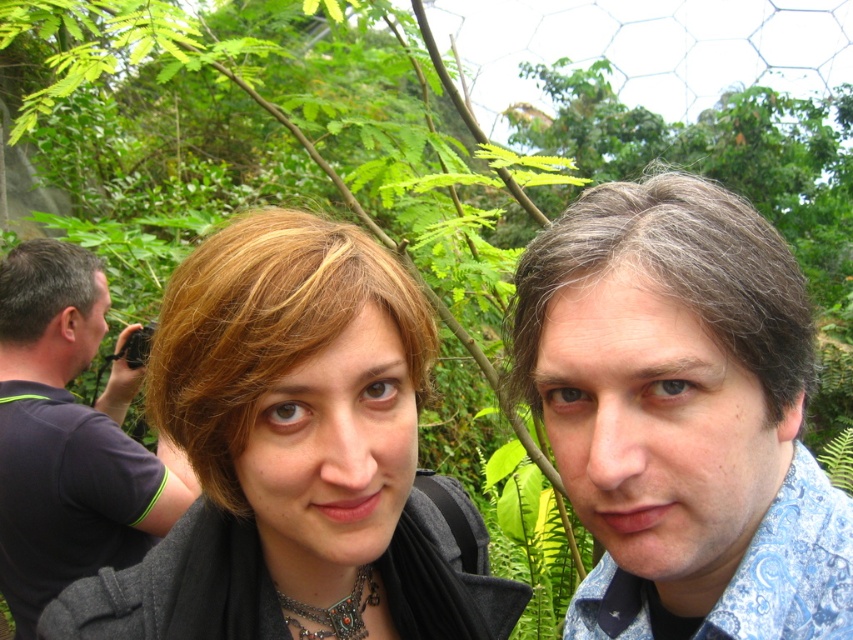
Can you confirm if matte black jacket at center is bigger than dark blue t-shirt at left?

Actually, matte black jacket at center might be smaller than dark blue t-shirt at left.

Is matte black jacket at center thinner than dark blue t-shirt at left?

No.

The width and height of the screenshot is (853, 640). Identify the location of matte black jacket at center. (294, 452).

Can you confirm if blue paisley shirt at right is wider than dark blue t-shirt at left?

Incorrect, blue paisley shirt at right's width does not surpass dark blue t-shirt at left's.

Between blue paisley shirt at right and dark blue t-shirt at left, which one has more height?

Standing taller between the two is dark blue t-shirt at left.

Find the location of `blue paisley shirt at right`. blue paisley shirt at right is located at coordinates (682, 413).

You are a GUI agent. You are given a task and a screenshot of the screen. Output one action in this format:
    pyautogui.click(x=<x>, y=<y>)
    Task: Click on the blue paisley shirt at right
    The image size is (853, 640).
    Given the screenshot: What is the action you would take?
    pyautogui.click(x=682, y=413)

Looking at this image, is blue paisley shirt at right to the left of matte black jacket at center from the viewer's perspective?

Incorrect, blue paisley shirt at right is not on the left side of matte black jacket at center.

Does blue paisley shirt at right have a larger size compared to matte black jacket at center?

No.

This screenshot has height=640, width=853. In order to click on blue paisley shirt at right in this screenshot , I will do `click(682, 413)`.